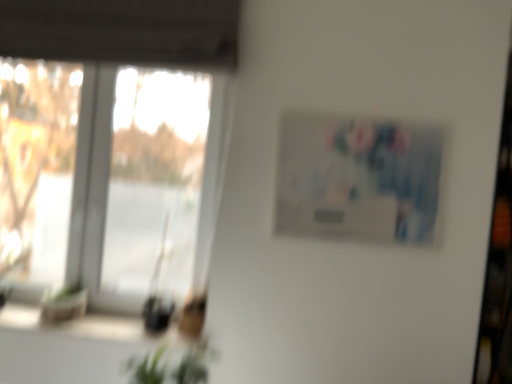
What do you see at coordinates (174, 368) in the screenshot? I see `green leafy plant at lower left` at bounding box center [174, 368].

Measure the distance between point [195,136] and camera.

They are 8.01 feet apart.

What do you see at coordinates (106, 180) in the screenshot? I see `transparent glass window at left` at bounding box center [106, 180].

Where is `green leafy plant at lower left`? green leafy plant at lower left is located at coordinates (174, 368).

Locate an element on the screen. window directly beneath the matte plastic picture frame at upper right (from a real-world perspective) is located at coordinates (106, 180).

Considering the points (345, 138) and (9, 275), which point is in front, point (345, 138) or point (9, 275)?

The point (345, 138) is more forward.

From a real-world perspective, is matte plastic picture frame at upper right positioned above or below transparent glass window at left?

Clearly, from a real-world perspective, matte plastic picture frame at upper right is above transparent glass window at left.

Looking at this image, from the image's perspective, which object appears higher, matte plastic picture frame at upper right or transparent glass window at left?

matte plastic picture frame at upper right, from the image's perspective.

Is green leafy plant at lower center positioned beyond the bounds of green leafy plant at lower left?

Yes, green leafy plant at lower center is outside of green leafy plant at lower left.

What's the angular difference between green leafy plant at lower center and green leafy plant at lower left's facing directions?

The facing directions of green leafy plant at lower center and green leafy plant at lower left are 0.0053 degrees apart.

From the image's perspective, which object appears higher, green leafy plant at lower center or green leafy plant at lower left?

From the image's view, green leafy plant at lower left is above.

From a real-world perspective, between green leafy plant at lower center and green leafy plant at lower left, who is vertically lower?

From a 3D spatial view, green leafy plant at lower left is below.

From the picture: Can you confirm if green leafy plant at lower left is smaller than green leafy plant at lower center?

No, green leafy plant at lower left is not smaller than green leafy plant at lower center.

How different are the orientations of green leafy plant at lower left and green leafy plant at lower center in degrees?

0.0053 degrees.

From a real-world perspective, who is located lower, green leafy plant at lower left or green leafy plant at lower center?

In real-world perspective, green leafy plant at lower left is lower.

Is transparent glass window at left in front of or behind matte plastic picture frame at upper right in the image?

In the image, transparent glass window at left appears behind matte plastic picture frame at upper right.

Is point (162, 203) positioned behind point (402, 203)?

Yes, point (162, 203) is farther from viewer.

Are transparent glass window at left and matte plastic picture frame at upper right making contact?

No.

From the image's perspective, does transparent glass window at left appear lower than matte plastic picture frame at upper right?

Indeed, from the image's perspective, transparent glass window at left is shown beneath matte plastic picture frame at upper right.

Would you say transparent glass window at left is a long distance from green leafy plant at lower center?

Yes, transparent glass window at left is far from green leafy plant at lower center.

Is green leafy plant at lower center at the back of transparent glass window at left?

No, transparent glass window at left is not facing the opposite direction of green leafy plant at lower center.

Between transparent glass window at left and green leafy plant at lower center, which one appears on the left side from the viewer's perspective?

From the viewer's perspective, transparent glass window at left appears more on the left side.

Does transparent glass window at left have a larger size compared to green leafy plant at lower center?

Yes.

From the image's perspective, is transparent glass window at left above or below green leafy plant at lower left?

transparent glass window at left is above green leafy plant at lower left.

How much distance is there between transparent glass window at left and green leafy plant at lower left?

transparent glass window at left is 1.16 meters from green leafy plant at lower left.

This screenshot has height=384, width=512. Find the location of `window above the green leafy plant at lower left (from the image's perspective)`. window above the green leafy plant at lower left (from the image's perspective) is located at coordinates (x=106, y=180).

Is transparent glass window at left situated inside green leafy plant at lower left or outside?

transparent glass window at left is spatially situated outside green leafy plant at lower left.

Considering the points (184, 372) and (112, 253), which point is behind, point (184, 372) or point (112, 253)?

Positioned behind is point (112, 253).

How many degrees apart are the facing directions of green leafy plant at lower center and transparent glass window at left?

There is a 88.9-degree angle between the facing directions of green leafy plant at lower center and transparent glass window at left.

From the image's perspective, is green leafy plant at lower center over transparent glass window at left?

Incorrect, from the image's perspective, green leafy plant at lower center is lower than transparent glass window at left.

Which of these two, green leafy plant at lower center or transparent glass window at left, is wider?

Wider between the two is green leafy plant at lower center.

The height and width of the screenshot is (384, 512). I want to click on picture frame in front of the transparent glass window at left, so click(x=358, y=179).

At what (x,y) coordinates should I click in order to perform the action: click on plant behind the green leafy plant at lower left. Please return your answer as a coordinate pair (x, y). Looking at the image, I should click on (195, 364).

Considering their positions, is transparent glass window at left positioned further to green leafy plant at lower left than green leafy plant at lower center?

transparent glass window at left is positioned further to the anchor green leafy plant at lower left.

Based on their spatial positions, is green leafy plant at lower center or green leafy plant at lower left closer to transparent glass window at left?

green leafy plant at lower left is closer to transparent glass window at left.

Which object lies further to the anchor point matte plastic picture frame at upper right, green leafy plant at lower center or transparent glass window at left?

Based on the image, green leafy plant at lower center appears to be further to matte plastic picture frame at upper right.

Looking at the image, which one is located further to green leafy plant at lower left, matte plastic picture frame at upper right or green leafy plant at lower center?

matte plastic picture frame at upper right lies further to green leafy plant at lower left than the other object.

In the scene shown: Estimate the real-world distances between objects in this image. Which object is further from green leafy plant at lower left, transparent glass window at left or matte plastic picture frame at upper right?

transparent glass window at left.

Based on their spatial positions, is green leafy plant at lower center or matte plastic picture frame at upper right closer to green leafy plant at lower left?

The object closer to green leafy plant at lower left is green leafy plant at lower center.

Based on their spatial positions, is green leafy plant at lower left or matte plastic picture frame at upper right further from green leafy plant at lower center?

matte plastic picture frame at upper right.

Considering their positions, is green leafy plant at lower center positioned closer to matte plastic picture frame at upper right than green leafy plant at lower left?

green leafy plant at lower left.

Locate an element on the screen. Image resolution: width=512 pixels, height=384 pixels. plant situated between transparent glass window at left and matte plastic picture frame at upper right from left to right is located at coordinates (195, 364).

The width and height of the screenshot is (512, 384). Find the location of `plant between green leafy plant at lower left and matte plastic picture frame at upper right from front to back`. plant between green leafy plant at lower left and matte plastic picture frame at upper right from front to back is located at coordinates (195, 364).

The height and width of the screenshot is (384, 512). Identify the location of plant between green leafy plant at lower left and transparent glass window at left in the front-back direction. (195, 364).

Locate an element on the screen. Image resolution: width=512 pixels, height=384 pixels. picture frame located between green leafy plant at lower left and transparent glass window at left in the depth direction is located at coordinates (358, 179).